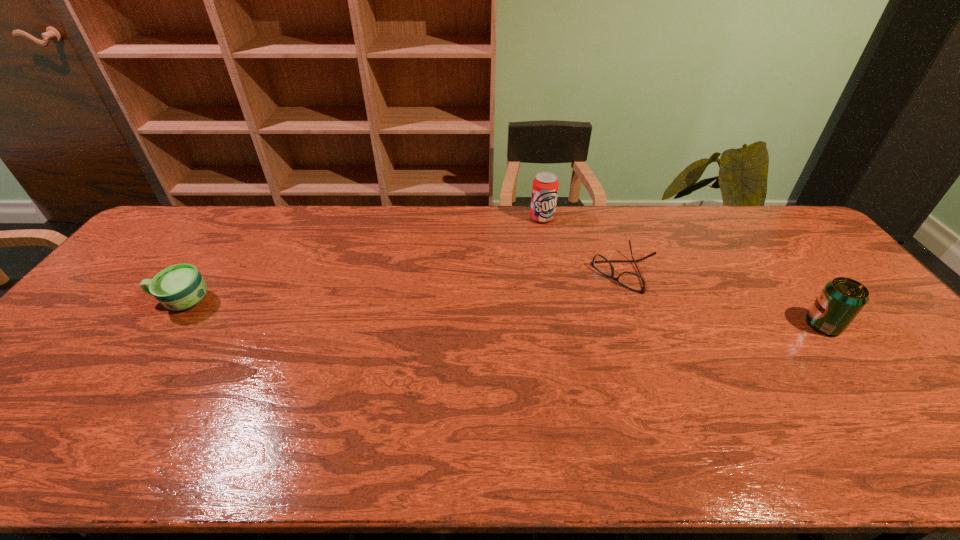
Where is `vacant space located on the surface of the soda can`? This screenshot has width=960, height=540. vacant space located on the surface of the soda can is located at coordinates (551, 254).

Find the location of a particular element. This screenshot has height=540, width=960. free space located 0.060m on the surface of the soda can is located at coordinates (546, 235).

Locate an element on the screen. This screenshot has width=960, height=540. vacant area situated on the surface of the soda can is located at coordinates click(548, 240).

Image resolution: width=960 pixels, height=540 pixels. What are the coordinates of `vacant area situated on the front-facing side of the shortest object` in the screenshot? It's located at (577, 312).

Where is `free spot located 0.240m on the front-facing side of the shortest object`? This screenshot has height=540, width=960. free spot located 0.240m on the front-facing side of the shortest object is located at coordinates (554, 331).

I want to click on free spot located on the front-facing side of the shortest object, so click(x=572, y=315).

Locate an element on the screen. The image size is (960, 540). object that is at the far edge is located at coordinates (545, 186).

Find the location of a particular element. Image resolution: width=960 pixels, height=540 pixels. object that is at the right edge is located at coordinates (841, 300).

This screenshot has width=960, height=540. In order to click on blank space at the far edge of the desktop in this screenshot , I will do click(703, 239).

Identify the location of vacant region at the near edge of the desktop. The width and height of the screenshot is (960, 540). (853, 389).